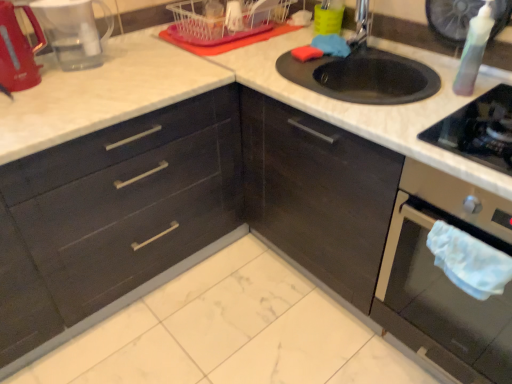
Question: In terms of width, does matte black drawers at left look wider or thinner when compared to red plastic coffee maker at upper left?

Choices:
 (A) thin
 (B) wide

Answer: (B)

Question: In terms of height, does matte black drawers at left look taller or shorter compared to red plastic coffee maker at upper left?

Choices:
 (A) short
 (B) tall

Answer: (B)

Question: Estimate the real-world distances between objects in this image. Which object is farther from the matte black drawers at left?

Choices:
 (A) metallic red kettle at left, the 1th appliance from the left
 (B) metallic silver faucet at upper right
 (C) matte black oven at lower right
 (D) transparent plastic bottle at upper right
 (E) transparent plastic bottle at upper right, the second appliance in the left-to-right sequence

Answer: (E)

Question: Estimate the real-world distances between objects in this image. Which object is farther from the metallic red kettle at left, which is the second appliance from right to left?

Choices:
 (A) metallic silver faucet at upper right
 (B) matte black drawers at left
 (C) transparent plastic bottle at upper right
 (D) white plastic basket at upper center
 (E) red plastic coffee maker at upper left

Answer: (C)